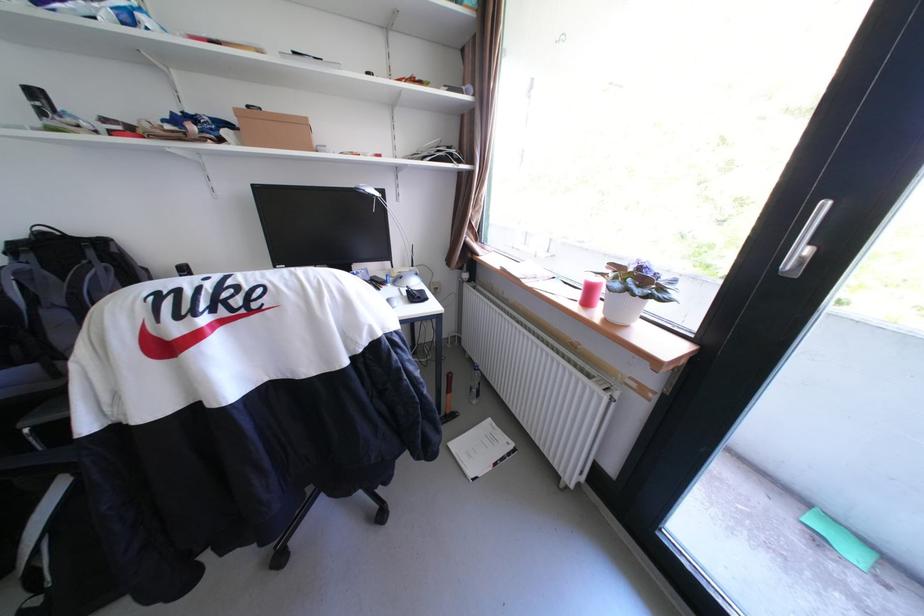
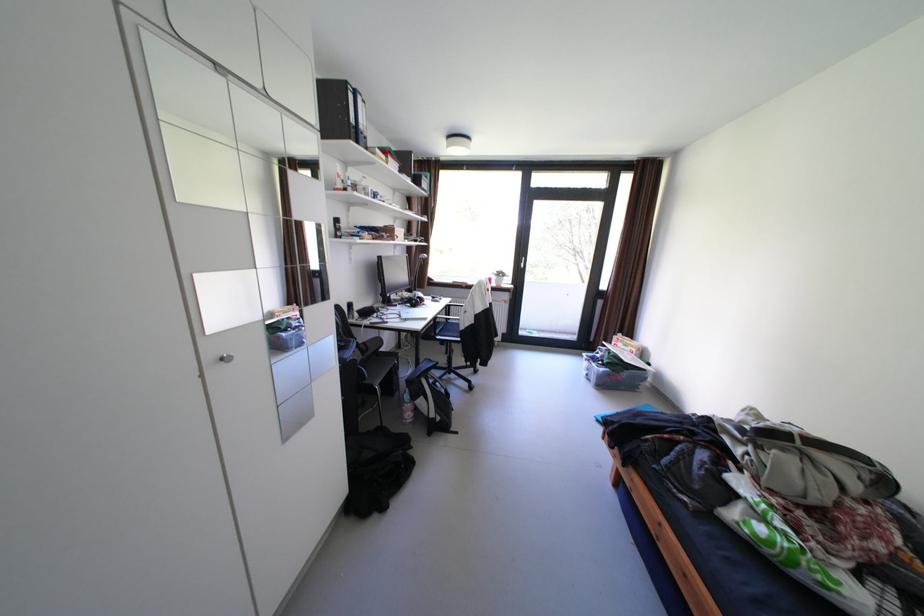
Where in the second image is the point corresponding to point 382,198 from the first image?

(432, 259)